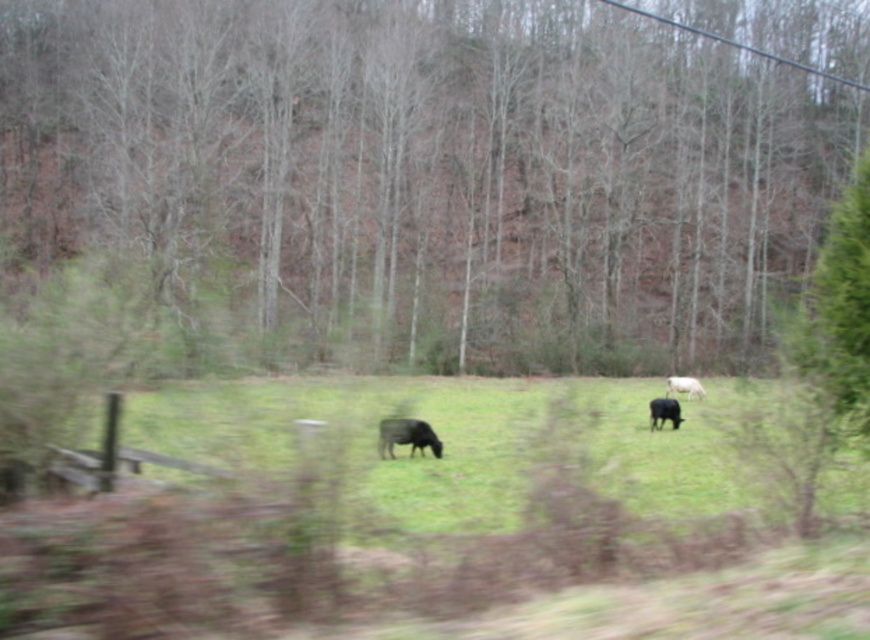
Question: Estimate the real-world distances between objects in this image. Which object is farther from the black wire at upper right?

Choices:
 (A) black matte cow at center
 (B) black glossy cow at center
 (C) brown bark tree at center

Answer: (A)

Question: Estimate the real-world distances between objects in this image. Which object is farther from the black wire at upper right?

Choices:
 (A) black glossy cow at center
 (B) brown bark tree at center
 (C) black matte cow at center

Answer: (C)

Question: Among these objects, which one is nearest to the camera?

Choices:
 (A) white woolly sheep at right
 (B) black glossy cow at center
 (C) black matte cow at center

Answer: (C)

Question: Can you confirm if black glossy cow at center is positioned below white woolly sheep at right?

Choices:
 (A) no
 (B) yes

Answer: (B)

Question: Considering the relative positions of black matte cow at center and black wire at upper right in the image provided, where is black matte cow at center located with respect to black wire at upper right?

Choices:
 (A) below
 (B) above

Answer: (A)

Question: Does black wire at upper right have a larger size compared to white woolly sheep at right?

Choices:
 (A) no
 (B) yes

Answer: (B)